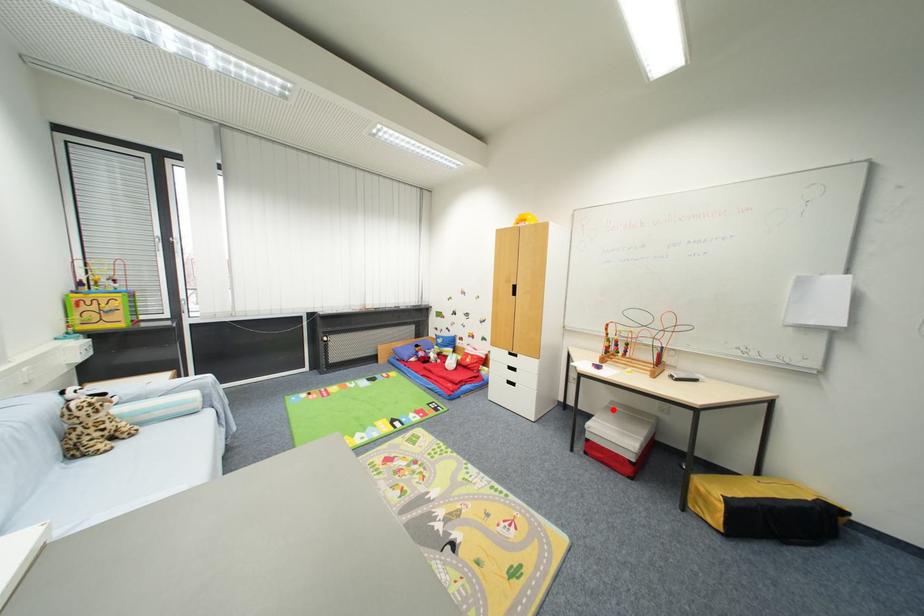
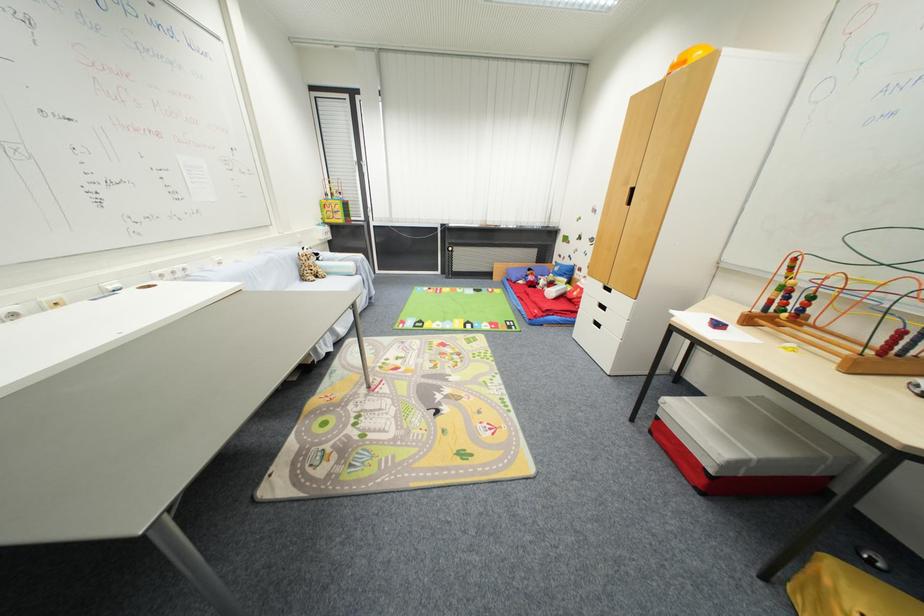
In the second image, find the point that corresponds to the highlighted location in the first image.

(745, 402)